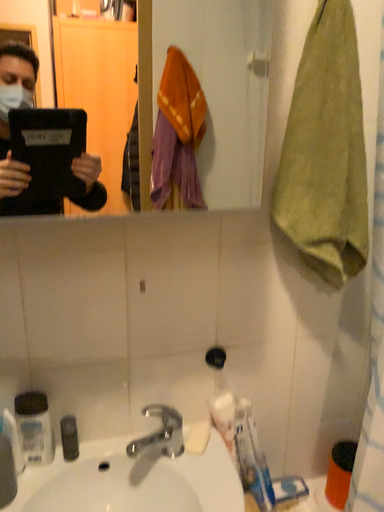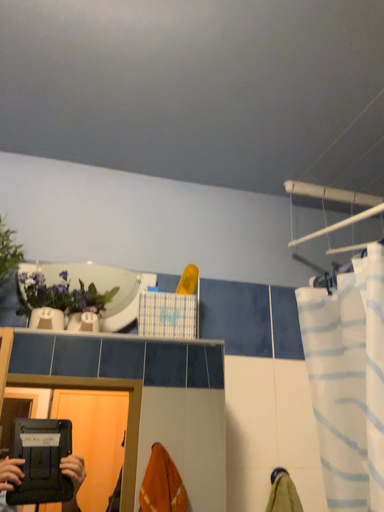
Question: Which way did the camera rotate in the video?

Choices:
 (A) rotated downward
 (B) rotated upward

Answer: (B)